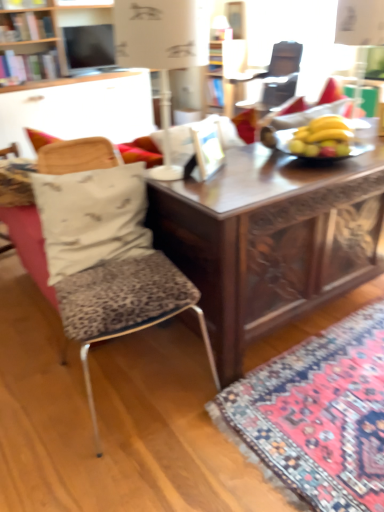
In order to face matte black television at upper center, should I rotate leftwards or rightwards?

To align with it, rotate left about 12.075°.

Find the location of a particular element. Image resolution: width=384 pixels, height=512 pixels. leopard print fabric chair at left is located at coordinates (124, 307).

Image resolution: width=384 pixels, height=512 pixels. I want to click on white paper lampshade at upper center, so (x=158, y=53).

The width and height of the screenshot is (384, 512). Identify the location of matte black television at upper center. (89, 46).

From the picture: From the image's perspective, is white fabric pillow at left on yellow matte bananas at center?

Incorrect, from the image's perspective, white fabric pillow at left is lower than yellow matte bananas at center.

You are a GUI agent. You are given a task and a screenshot of the screen. Output one action in this format:
    pyautogui.click(x=<x>, y=<y>)
    Task: Click on the banana above the white fabric pillow at left (from a real-world perspective)
    The width and height of the screenshot is (384, 512).
    Given the screenshot: What is the action you would take?
    pyautogui.click(x=322, y=138)

Is white fabric pillow at left to the left or to the right of yellow matte bananas at center in the image?

white fabric pillow at left is positioned on yellow matte bananas at center's left side.

Are leopard print fabric chair at left and matte black television at upper center far apart?

Yes.

From the image's perspective, is leopard print fabric chair at left under matte black television at upper center?

Correct, leopard print fabric chair at left appears lower than matte black television at upper center in the image.

How distant is leopard print fabric chair at left from matte black television at upper center?

13.64 feet.

In terms of width, does leopard print fabric chair at left look wider or thinner when compared to matte black television at upper center?

leopard print fabric chair at left is wider than matte black television at upper center.

Considering the positions of point (299, 479) and point (319, 188), is point (299, 479) closer or farther from the camera than point (319, 188)?

Point (299, 479).

Locate an element on the screen. desk behind the carpet with intricate patterns at lower right is located at coordinates (269, 239).

Is wooden carved desk at center surrounded by carpet with intricate patterns at lower right?

No, wooden carved desk at center is not inside carpet with intricate patterns at lower right.

Considering the positions of objects carpet with intricate patterns at lower right and wooden carved desk at center in the image provided, who is behind, carpet with intricate patterns at lower right or wooden carved desk at center?

wooden carved desk at center is further from the camera.

Can you tell me how much yellow matte bananas at center and white paper lampshade at upper center differ in facing direction?

The facing directions of yellow matte bananas at center and white paper lampshade at upper center are 3.77 degrees apart.

Is point (304, 146) positioned after point (191, 39)?

That is True.

Between yellow matte bananas at center and white paper lampshade at upper center, which one has larger size?

Bigger between the two is white paper lampshade at upper center.

Is yellow matte bananas at center beside white paper lampshade at upper center?

No, yellow matte bananas at center is not making contact with white paper lampshade at upper center.

Which object is further away from the camera taking this photo, leopard print fabric chair at left or yellow matte bananas at center?

Positioned behind is yellow matte bananas at center.

From the picture: Measure the distance from leopard print fabric chair at left to yellow matte bananas at center.

leopard print fabric chair at left is 32.05 inches from yellow matte bananas at center.

Does point (98, 140) appear closer or farther from the camera than point (321, 119)?

Point (98, 140) is closer to the camera than point (321, 119).

Considering the relative sizes of leopard print fabric chair at left and yellow matte bananas at center in the image provided, is leopard print fabric chair at left smaller than yellow matte bananas at center?

Incorrect, leopard print fabric chair at left is not smaller in size than yellow matte bananas at center.

Would you consider wooden picture frame at center to be distant from leopard print fabric chair at left?

No, there isn't a large distance between wooden picture frame at center and leopard print fabric chair at left.

Measure the distance from wooden picture frame at center to leopard print fabric chair at left.

The distance of wooden picture frame at center from leopard print fabric chair at left is 19.38 inches.

Considering the relative sizes of wooden picture frame at center and leopard print fabric chair at left in the image provided, is wooden picture frame at center thinner than leopard print fabric chair at left?

Indeed, wooden picture frame at center has a lesser width compared to leopard print fabric chair at left.

What's the angular difference between wooden picture frame at center and leopard print fabric chair at left's facing directions?

32.8 degrees.

Between white fabric pillow at left and carpet with intricate patterns at lower right, which one appears on the right side from the viewer's perspective?

carpet with intricate patterns at lower right.

The height and width of the screenshot is (512, 384). In order to click on mat on the right side of white fabric pillow at left in this screenshot , I will do 320,414.

Based on the photo, would you say white fabric pillow at left contains carpet with intricate patterns at lower right?

No, carpet with intricate patterns at lower right is not surrounded by white fabric pillow at left.

Is white fabric pillow at left directly adjacent to carpet with intricate patterns at lower right?

There is a gap between white fabric pillow at left and carpet with intricate patterns at lower right.

Locate an element on the screen. This screenshot has width=384, height=512. banana that appears above the white fabric pillow at left (from the image's perspective) is located at coordinates (322, 138).

The image size is (384, 512). Find the location of `chair to the right of matte black television at upper center`. chair to the right of matte black television at upper center is located at coordinates (124, 307).

Estimate the real-world distances between objects in this image. Which object is further from carpet with intricate patterns at lower right, wooden carved desk at center or matte black television at upper center?

The object further to carpet with intricate patterns at lower right is matte black television at upper center.

When comparing their distances from white fabric pillow at left, does carpet with intricate patterns at lower right or white paper lampshade at upper center seem closer?

carpet with intricate patterns at lower right.

From the image, which object appears to be nearer to leopard print fabric chair at left, yellow matte bananas at center or white paper lampshade at upper center?

yellow matte bananas at center is positioned closer to the anchor leopard print fabric chair at left.

When comparing their distances from wooden carved desk at center, does carpet with intricate patterns at lower right or white fabric pillow at left seem further?

carpet with intricate patterns at lower right is further to wooden carved desk at center.

Estimate the real-world distances between objects in this image. Which object is further from matte black television at upper center, yellow matte bananas at center or white fabric pillow at left?

Based on the image, yellow matte bananas at center appears to be further to matte black television at upper center.

Looking at the image, which one is located further to white paper lampshade at upper center, leopard print fabric chair at left or yellow matte bananas at center?

Among the two, leopard print fabric chair at left is located further to white paper lampshade at upper center.

Looking at the image, which one is located closer to carpet with intricate patterns at lower right, white paper lampshade at upper center or leopard print fabric chair at left?

The object closer to carpet with intricate patterns at lower right is leopard print fabric chair at left.

Estimate the real-world distances between objects in this image. Which object is closer to carpet with intricate patterns at lower right, white paper lampshade at upper center or wooden picture frame at center?

Among the two, wooden picture frame at center is located nearer to carpet with intricate patterns at lower right.

You are a GUI agent. You are given a task and a screenshot of the screen. Output one action in this format:
    pyautogui.click(x=<x>, y=<y>)
    Task: Click on the banana between white paper lampshade at upper center and matte black television at upper center along the z-axis
    
    Given the screenshot: What is the action you would take?
    pyautogui.click(x=322, y=138)

Find the location of a particular element. desk between yellow matte bananas at center and carpet with intricate patterns at lower right from top to bottom is located at coordinates point(269,239).

You are a GUI agent. You are given a task and a screenshot of the screen. Output one action in this format:
    pyautogui.click(x=<x>, y=<y>)
    Task: Click on the chair between white paper lampshade at upper center and carpet with intricate patterns at lower right from top to bottom
    
    Given the screenshot: What is the action you would take?
    pyautogui.click(x=124, y=307)

The width and height of the screenshot is (384, 512). Identify the location of picture frame between white fabric pillow at left and wooden carved desk at center from left to right. (207, 147).